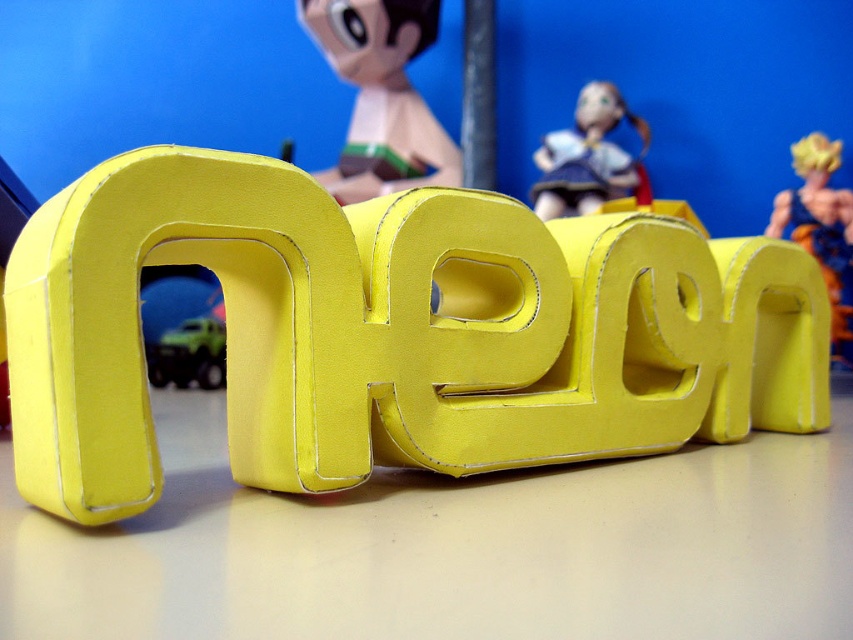
Does matte yellow table at center appear under shiny gold action figure at right?

Yes.

Who is higher up, matte yellow table at center or shiny gold action figure at right?

shiny gold action figure at right is above.

In order to click on matte yellow table at center in this screenshot , I will do `click(451, 547)`.

At what (x,y) coordinates should I click in order to perform the action: click on matte yellow table at center. Please return your answer as a coordinate pair (x, y). Image resolution: width=853 pixels, height=640 pixels. Looking at the image, I should click on (451, 547).

Which is more to the right, yellow cardboard letter at center or matte yellow table at center?

Positioned to the right is yellow cardboard letter at center.

Does yellow cardboard letter at center lie in front of matte yellow table at center?

No, yellow cardboard letter at center is behind matte yellow table at center.

Where is `yellow cardboard letter at center`? This screenshot has width=853, height=640. yellow cardboard letter at center is located at coordinates (392, 332).

Find the location of `yellow cardboard letter at center`. yellow cardboard letter at center is located at coordinates (392, 332).

Does point (506, 524) come behind point (177, 333)?

No, (506, 524) is in front of (177, 333).

Measure the distance between matte yellow table at center and camera.

matte yellow table at center and camera are 23.51 inches apart from each other.

Identify the location of matte yellow table at center. (451, 547).